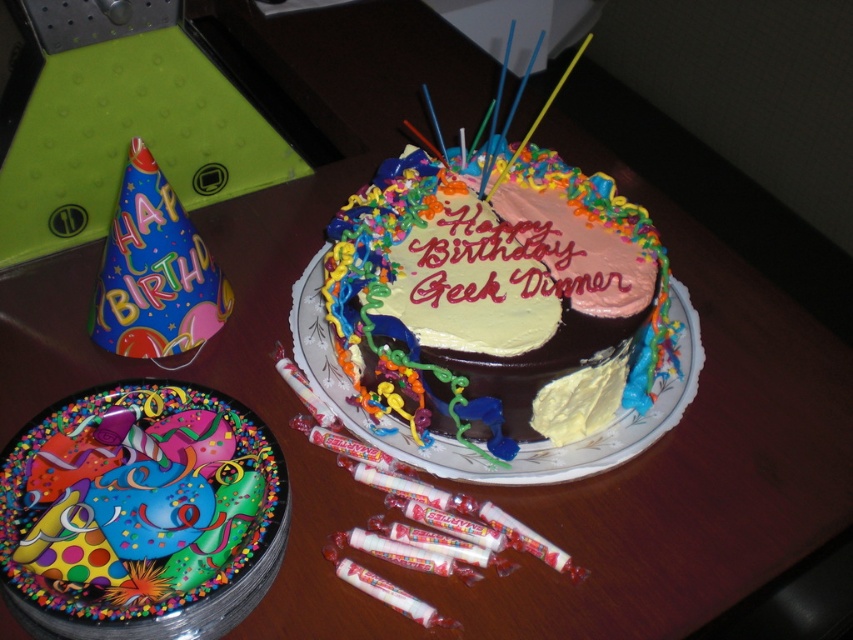
Between chocolate frosted cake at center and yellow matte frosting at center, which one appears on the right side from the viewer's perspective?

yellow matte frosting at center

How distant is chocolate frosted cake at center from yellow matte frosting at center?

chocolate frosted cake at center and yellow matte frosting at center are 13.19 centimeters apart from each other.

Who is more distant from viewer, (x=396, y=228) or (x=595, y=376)?

The point (x=396, y=228) is more distant.

Find the location of a particular element. Image resolution: width=853 pixels, height=640 pixels. chocolate frosted cake at center is located at coordinates (494, 294).

In the scene shown: Which of these two, decorative paper plate at center or yellow matte frosting at center, stands taller?

decorative paper plate at center

Does point (131, 436) lie in front of point (618, 403)?

Yes, point (131, 436) is in front of point (618, 403).

The image size is (853, 640). I want to click on decorative paper plate at center, so click(140, 515).

Who is lower down, chocolate frosted cake at center or decorative paper plate at center?

decorative paper plate at center is below.

Between chocolate frosted cake at center and decorative paper plate at center, which one is positioned higher?

Positioned higher is chocolate frosted cake at center.

Locate an element on the screen. chocolate frosted cake at center is located at coordinates (494, 294).

In order to click on chocolate frosted cake at center in this screenshot , I will do pyautogui.click(x=494, y=294).